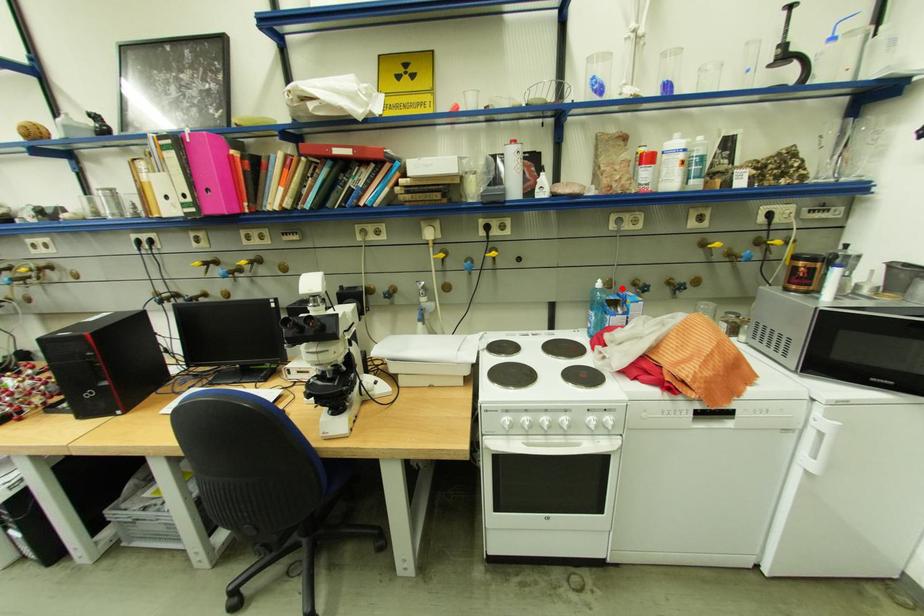
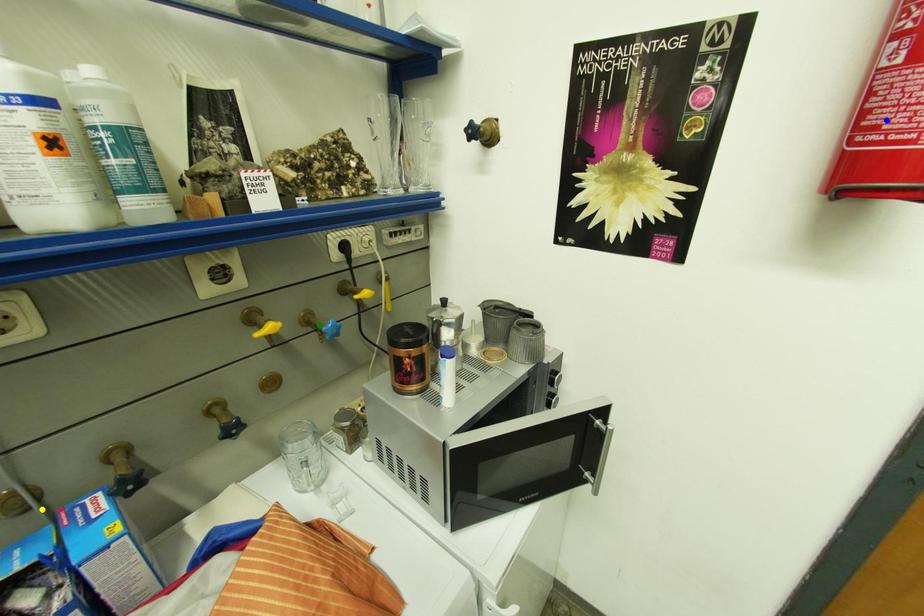
Question: I am providing you with two images of the same scene from different viewpoints. A red point is marked on the first image. You are given multiple points on the second image. Which point in image 2 represents the same 3d spot as the red point in image 1?

Choices:
 (A) blue point
 (B) green point
 (C) yellow point

Answer: (C)